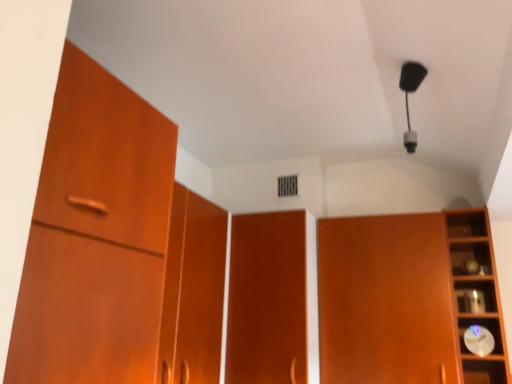
Question: Does matte wood cupboard at right appear on the left side of matte wood door at center?

Choices:
 (A) yes
 (B) no

Answer: (B)

Question: From a real-world perspective, is matte wood cupboard at right below matte wood door at center?

Choices:
 (A) no
 (B) yes

Answer: (B)

Question: Is matte wood cupboard at right facing away from matte wood door at center?

Choices:
 (A) yes
 (B) no

Answer: (B)

Question: From a real-world perspective, is matte wood cupboard at right positioned over matte wood door at center based on gravity?

Choices:
 (A) no
 (B) yes

Answer: (A)

Question: Does matte wood cupboard at right have a larger size compared to matte wood door at center?

Choices:
 (A) yes
 (B) no

Answer: (A)

Question: Does point (505, 357) appear closer or farther from the camera than point (263, 347)?

Choices:
 (A) farther
 (B) closer

Answer: (B)

Question: Considering the positions of wooden clock at right and matte wood door at center in the image, is wooden clock at right bigger or smaller than matte wood door at center?

Choices:
 (A) small
 (B) big

Answer: (A)

Question: From the image's perspective, relative to matte wood door at center, is wooden clock at right above or below?

Choices:
 (A) below
 (B) above

Answer: (B)

Question: Do you think wooden clock at right is within matte wood door at center, or outside of it?

Choices:
 (A) outside
 (B) inside

Answer: (A)

Question: Is matte wood cupboard at right in front of or behind matte wood door at center in the image?

Choices:
 (A) front
 (B) behind

Answer: (A)

Question: Looking at the image, does matte wood cupboard at right seem bigger or smaller compared to matte wood door at center?

Choices:
 (A) big
 (B) small

Answer: (A)

Question: Looking at their shapes, would you say matte wood cupboard at right is wider or thinner than matte wood door at center?

Choices:
 (A) thin
 (B) wide

Answer: (B)

Question: From a real-world perspective, is matte wood cupboard at right positioned above or below matte wood door at center?

Choices:
 (A) below
 (B) above

Answer: (A)

Question: Is wooden clock at right spatially inside matte wood cupboard at right, or outside of it?

Choices:
 (A) outside
 (B) inside

Answer: (A)

Question: Is point (502, 377) positioned closer to the camera than point (366, 269)?

Choices:
 (A) closer
 (B) farther

Answer: (A)